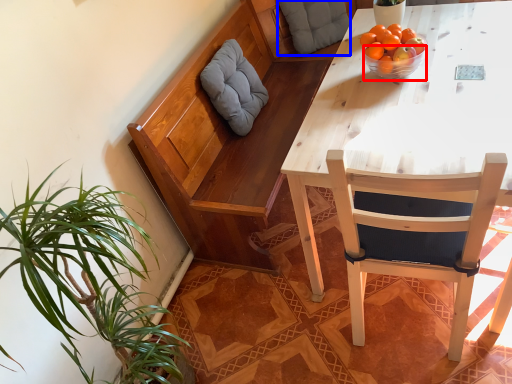
Question: Which object is further to the camera taking this photo, bowl (highlighted by a red box) or pillow (highlighted by a blue box)?

Choices:
 (A) bowl
 (B) pillow

Answer: (B)